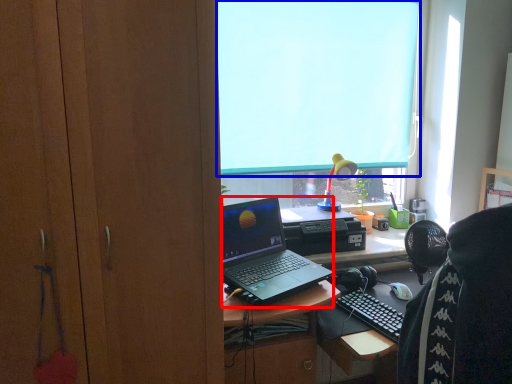
Question: Which object is closer to the camera taking this photo, laptop (highlighted by a red box) or window screen (highlighted by a blue box)?

Choices:
 (A) laptop
 (B) window screen

Answer: (A)